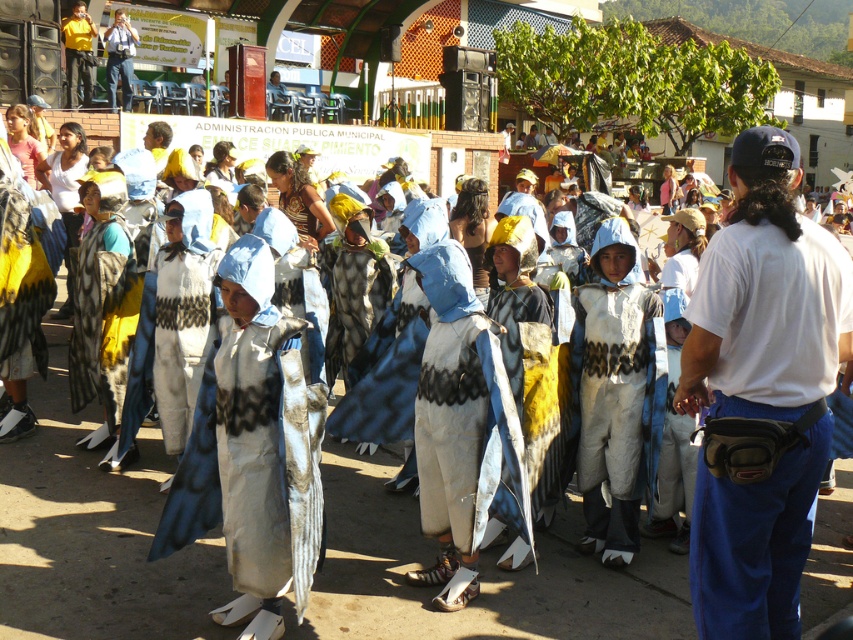
Question: Which point is farther from the camera taking this photo?

Choices:
 (A) (762, 522)
 (B) (109, 33)

Answer: (B)

Question: Can you confirm if white fabric fanny pack at right is positioned below white fabric costume at center?

Choices:
 (A) no
 (B) yes

Answer: (A)

Question: Which is farther from the white fabric costume at center?

Choices:
 (A) matte black camera at upper left
 (B) yellow shirt at upper left

Answer: (A)

Question: Estimate the real-world distances between objects in this image. Which object is farther from the white fabric costume at center?

Choices:
 (A) yellow shirt at upper left
 (B) white fabric fanny pack at right
 (C) matte black camera at upper left

Answer: (C)

Question: Is yellow shirt at upper left below matte black camera at upper left?

Choices:
 (A) no
 (B) yes

Answer: (B)

Question: Can you confirm if white fabric costume at center is positioned to the left of yellow shirt at upper left?

Choices:
 (A) no
 (B) yes

Answer: (A)